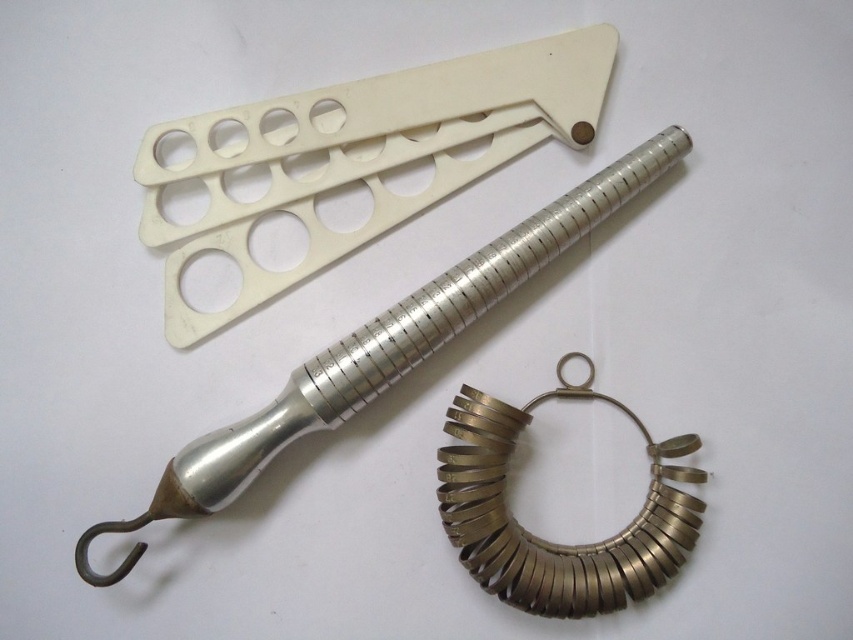
You are looking at the image of the tools on the white surface. There are two points marked in the scene. Which point is closer to you, point (392,320) or point (567,358)?

Point (392,320) is closer to you because it is in front of point (567,358) in the image.

In the scene shown: You are a jeweler who needs to place the silver metallic hook at lower left and the gold metallic ring at lower center into a storage box that has a maximum width of 12 inches. Can both items fit side by side in the box without overlapping?

The silver metallic hook at lower left and gold metallic ring at lower center are 11.18 inches apart from each other. Since the box has a maximum width of 12 inches, they can fit side by side as the distance between them is less than the box width.

You are a robot trying to locate the silver metallic hook at lower left in the image. What are its coordinates?

The silver metallic hook at lower left is located at coordinates point (x=383, y=349).